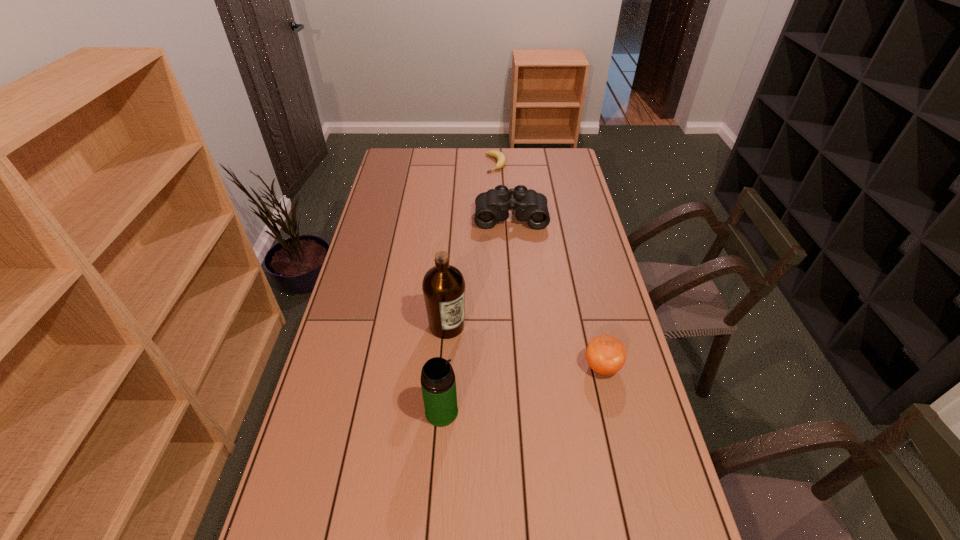
Where is `object situated at the far edge`? The image size is (960, 540). object situated at the far edge is located at coordinates (498, 155).

Locate an element on the screen. The image size is (960, 540). object present at the right edge is located at coordinates (605, 354).

This screenshot has height=540, width=960. Identify the location of vacant space at the far edge. (514, 150).

At what (x,y) coordinates should I click in order to perform the action: click on free point at the left edge. Please return your answer as a coordinate pair (x, y). The width and height of the screenshot is (960, 540). Looking at the image, I should click on (362, 253).

Find the location of a particular element. vacant region at the right edge of the desktop is located at coordinates (554, 204).

This screenshot has width=960, height=540. In order to click on vacant space at the near right corner in this screenshot , I will do `click(615, 533)`.

Locate an element on the screen. The width and height of the screenshot is (960, 540). free spot between the tallest object and the farthest object is located at coordinates (471, 245).

Find the location of `unoccupied position between the olive oil and the second nearest object`. unoccupied position between the olive oil and the second nearest object is located at coordinates (524, 346).

What are the coordinates of `empty space that is in between the banana and the orange` in the screenshot? It's located at (549, 265).

You are a GUI agent. You are given a task and a screenshot of the screen. Output one action in this format:
    pyautogui.click(x=<x>, y=<y>)
    Task: Click on the free spot between the binoculars and the nearest object
    
    Given the screenshot: What is the action you would take?
    pyautogui.click(x=476, y=314)